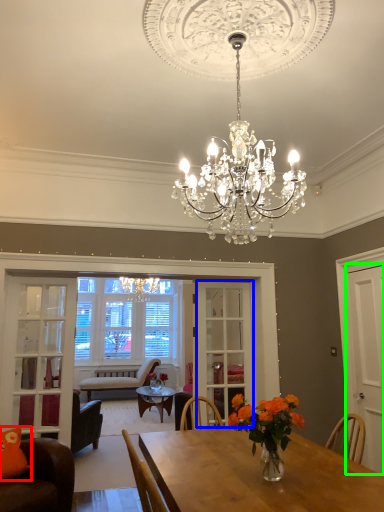
Question: Based on their relative distances, which object is nearer to pillow (highlighted by a red box)? Choose from glass door (highlighted by a blue box) and door (highlighted by a green box).

Choices:
 (A) glass door
 (B) door

Answer: (A)